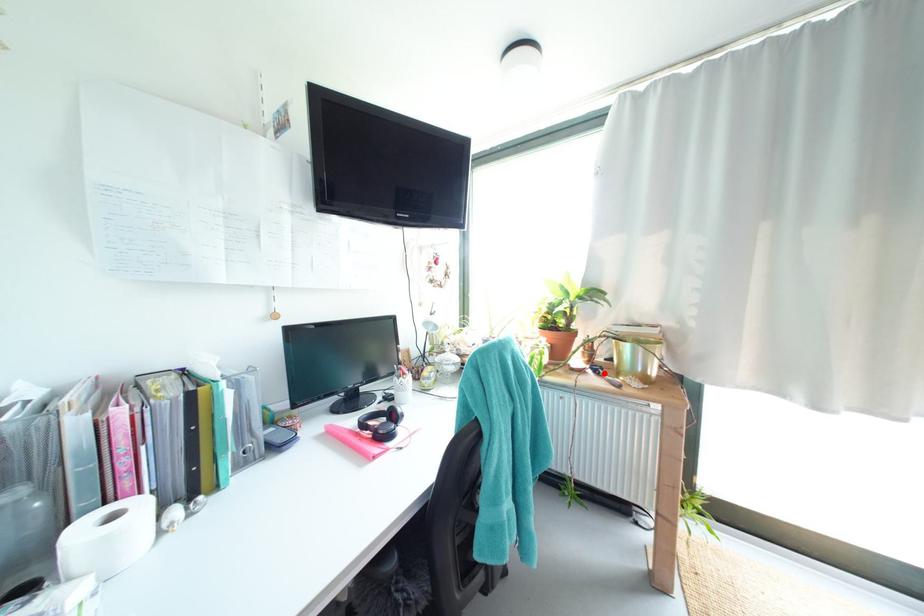
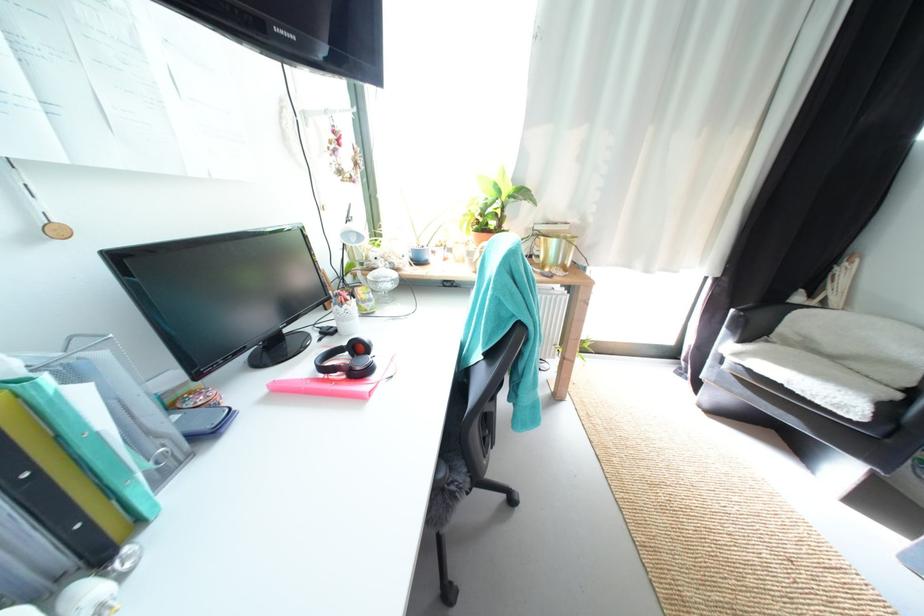
Where in the second image is the point corresponding to the highlighted location from the first image?

(535, 269)